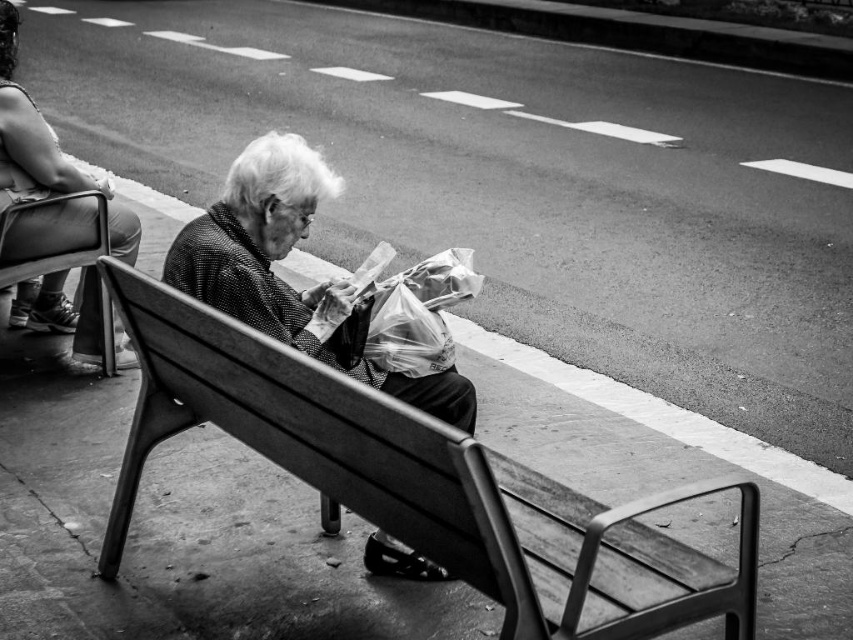
Does point (228, 262) lie in front of point (131, 237)?

Yes, it is.

Does smooth fabric sweater at center have a greater width compared to matte black jacket at upper left?

Correct, the width of smooth fabric sweater at center exceeds that of matte black jacket at upper left.

Between point (432, 410) and point (93, 282), which one is positioned in front?

Point (432, 410) is in front.

Where is `smooth fabric sweater at center`? The width and height of the screenshot is (853, 640). smooth fabric sweater at center is located at coordinates (285, 282).

In the scene shown: Is wooden bench at center smaller than matte black jacket at upper left?

No.

Find the location of a particular element. wooden bench at center is located at coordinates (422, 483).

Which is below, wooden bench at center or smooth fabric sweater at center?

wooden bench at center is lower down.

In the scene shown: Who is taller, wooden bench at center or smooth fabric sweater at center?

With more height is wooden bench at center.

Find the location of a particular element. The width and height of the screenshot is (853, 640). wooden bench at center is located at coordinates (422, 483).